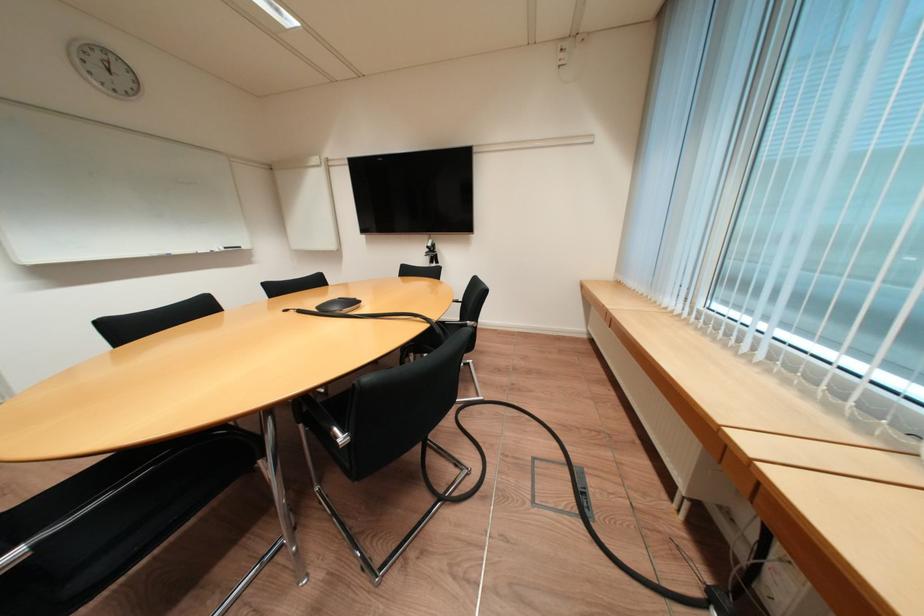
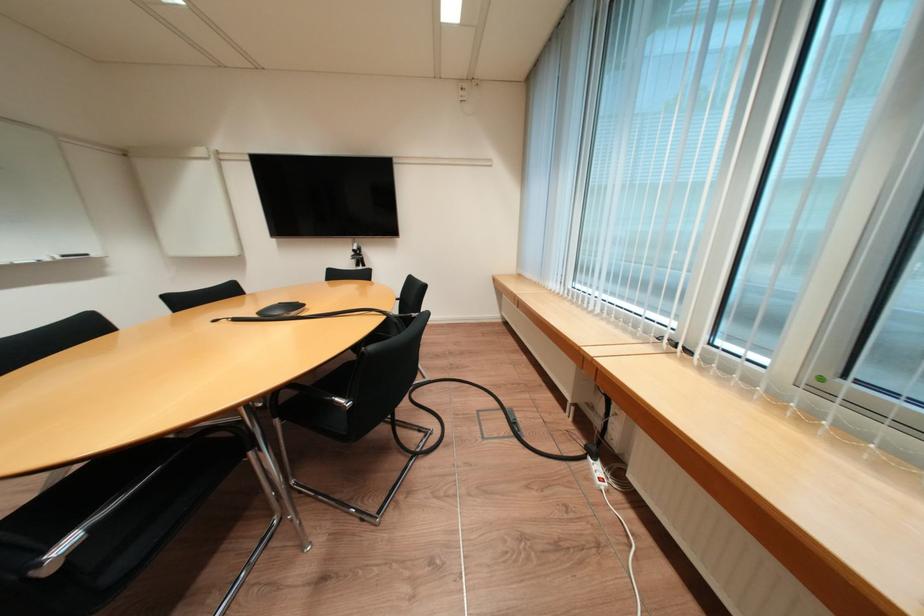
Where in the second image is the point corresponding to point (344, 430) from the first image?

(345, 400)